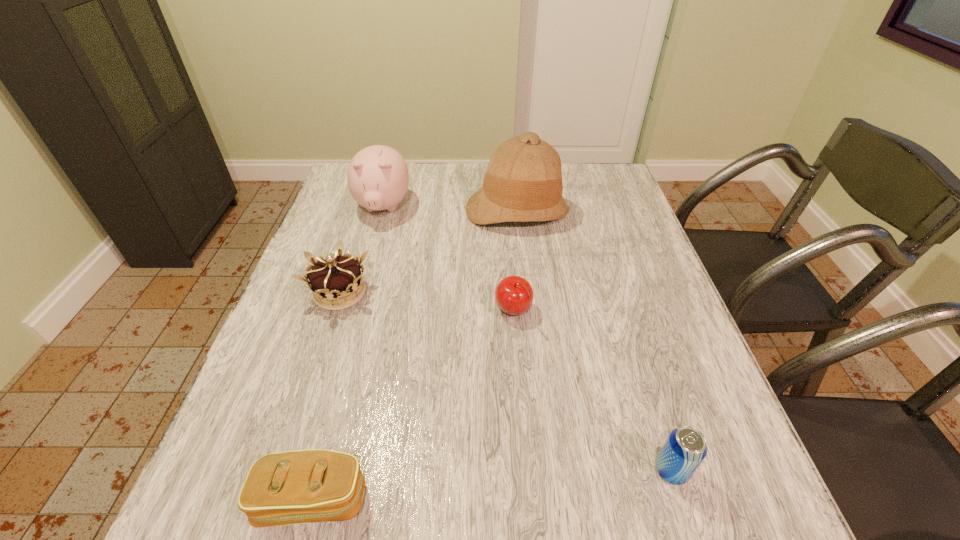
Find the location of `empty location between the cherry and the crown`. empty location between the cherry and the crown is located at coordinates (426, 302).

This screenshot has width=960, height=540. What are the coordinates of `vacant region between the clutch bag and the beer can` in the screenshot? It's located at (492, 485).

The image size is (960, 540). I want to click on free space that is in between the rightmost object and the piggy bank, so click(527, 339).

Image resolution: width=960 pixels, height=540 pixels. Find the location of `unoccupied area between the shortest object and the hat`. unoccupied area between the shortest object and the hat is located at coordinates (415, 355).

Where is `vacant area that lies between the shortest object and the hat`? The width and height of the screenshot is (960, 540). vacant area that lies between the shortest object and the hat is located at coordinates (415, 355).

Locate an element on the screen. free spot between the rightmost object and the piggy bank is located at coordinates (527, 339).

Where is `vacant space in between the beer can and the second tallest object`? vacant space in between the beer can and the second tallest object is located at coordinates (527, 339).

What are the coordinates of `empty location between the beer can and the piggy bank` in the screenshot? It's located at (527, 339).

Point out which object is positioned as the fifth nearest to the tallest object. Please provide its 2D coordinates. Your answer should be formatted as a tuple, i.e. [(x, y)], where the tuple contains the x and y coordinates of a point satisfying the conditions above.

[(292, 487)]

Choose which object is the fifth nearest neighbor to the crown. Please provide its 2D coordinates. Your answer should be formatted as a tuple, i.e. [(x, y)], where the tuple contains the x and y coordinates of a point satisfying the conditions above.

[(685, 448)]